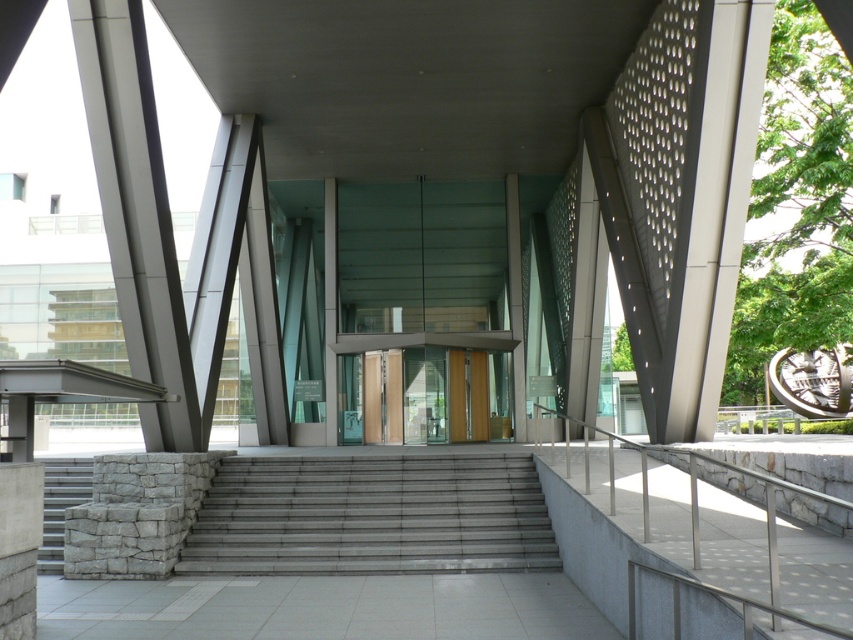
Does satin silver railing at right have a greater height compared to translucent glass doors at center?

No, satin silver railing at right is not taller than translucent glass doors at center.

Is satin silver railing at right further to camera compared to translucent glass doors at center?

No, satin silver railing at right is closer to the viewer.

Is point (679, 602) closer to viewer compared to point (437, 371)?

Yes.

You are a GUI agent. You are given a task and a screenshot of the screen. Output one action in this format:
    pyautogui.click(x=<x>, y=<y>)
    Task: Click on the satin silver railing at right
    The image size is (853, 640).
    Given the screenshot: What is the action you would take?
    pyautogui.click(x=711, y=538)

Which is in front, point (540, 531) or point (55, 561)?

Point (55, 561) is more forward.

Can you confirm if gray concrete stairs at center is positioned above gray stone stairs at lower left?

No, gray concrete stairs at center is not above gray stone stairs at lower left.

Is point (256, 563) positioned before point (74, 461)?

Yes.

Identify the location of gray concrete stairs at center. (370, 515).

Between satin silver railing at right and gray stone stairs at lower left, which one is positioned lower?

gray stone stairs at lower left is below.

Is point (595, 442) closer to camera compared to point (90, 464)?

That is False.

Does point (576, 449) come behind point (48, 508)?

That is True.

Locate an element on the screen. The height and width of the screenshot is (640, 853). satin silver railing at right is located at coordinates (711, 538).